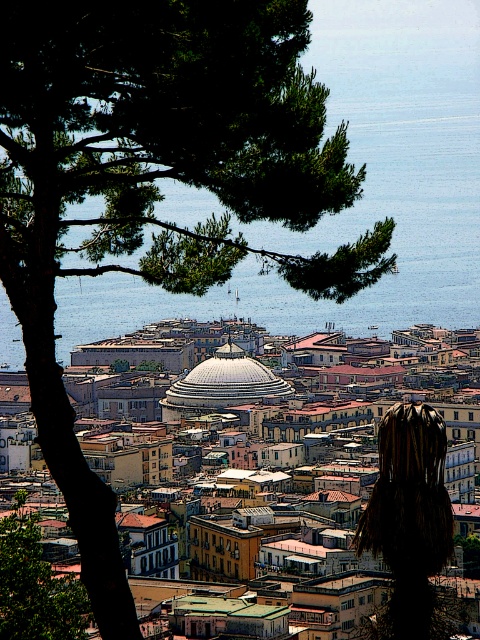
Question: Is the position of white dome at center more distant than that of brown textured tree at center?

Choices:
 (A) no
 (B) yes

Answer: (A)

Question: Estimate the real-world distances between objects in this image. Which object is closer to the white dome at center?

Choices:
 (A) white glossy dome at center
 (B) green leafy tree at upper left

Answer: (A)

Question: Which of these objects is positioned closest to the green leafy tree at upper left?

Choices:
 (A) white dome at center
 (B) brown textured tree at center
 (C) white glossy dome at center

Answer: (C)

Question: Is white dome at center bigger than brown textured tree at center?

Choices:
 (A) yes
 (B) no

Answer: (A)

Question: Which object is closer to the camera taking this photo?

Choices:
 (A) white glossy dome at center
 (B) white dome at center
 (C) green leafy tree at upper left
 (D) brown textured tree at center

Answer: (B)

Question: Can you confirm if brown textured tree at center is positioned above green leafy tree at upper left?

Choices:
 (A) no
 (B) yes

Answer: (B)